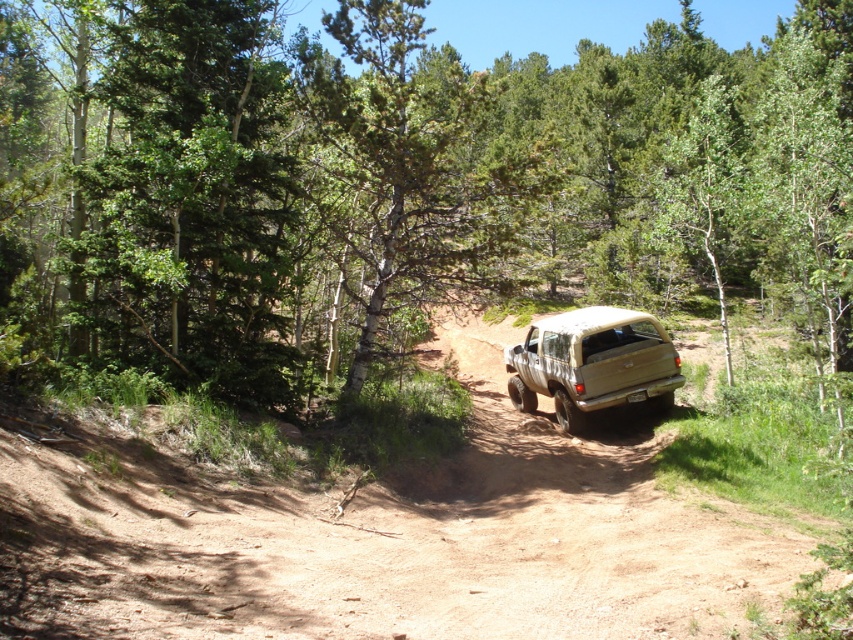
Who is higher up, green leafy tree at center or brown dirt track at center?

green leafy tree at center is higher up.

Can you confirm if green leafy tree at center is bigger than brown dirt track at center?

Indeed, green leafy tree at center has a larger size compared to brown dirt track at center.

Which is in front, point (451, 259) or point (550, 618)?

Positioned in front is point (550, 618).

The image size is (853, 640). Find the location of `green leafy tree at center`. green leafy tree at center is located at coordinates (399, 182).

Locate an element on the screen. The image size is (853, 640). green leafy tree at center is located at coordinates (399, 182).

You are a GUI agent. You are given a task and a screenshot of the screen. Output one action in this format:
    pyautogui.click(x=<x>, y=<y>)
    Task: Click on the green leafy tree at center
    
    Given the screenshot: What is the action you would take?
    pyautogui.click(x=399, y=182)

Can you confirm if brown dirt track at center is positioned below beige matte truck at center?

Indeed, brown dirt track at center is positioned under beige matte truck at center.

Can you confirm if brown dirt track at center is shorter than beige matte truck at center?

Yes, brown dirt track at center is shorter than beige matte truck at center.

What do you see at coordinates (381, 540) in the screenshot?
I see `brown dirt track at center` at bounding box center [381, 540].

The image size is (853, 640). Identify the location of brown dirt track at center. (381, 540).